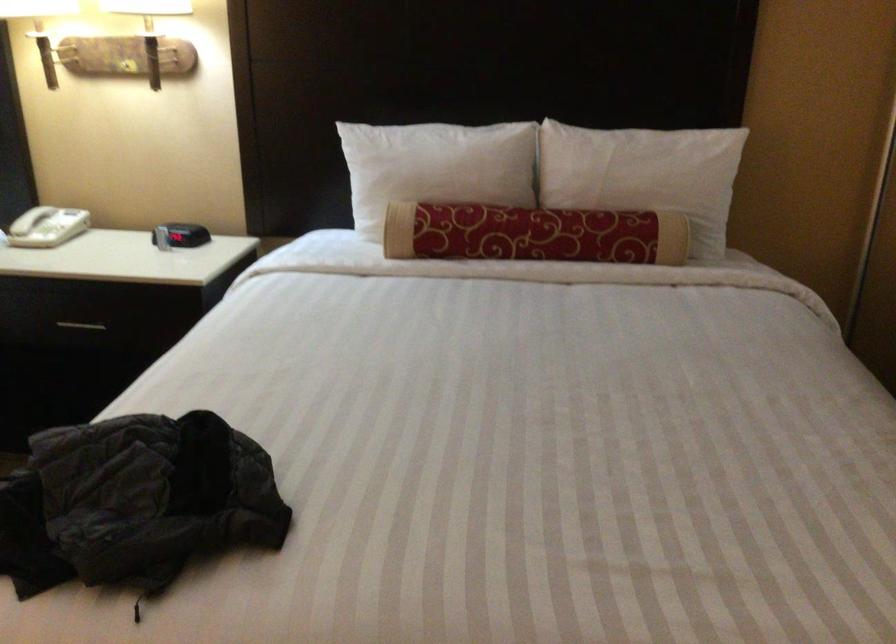
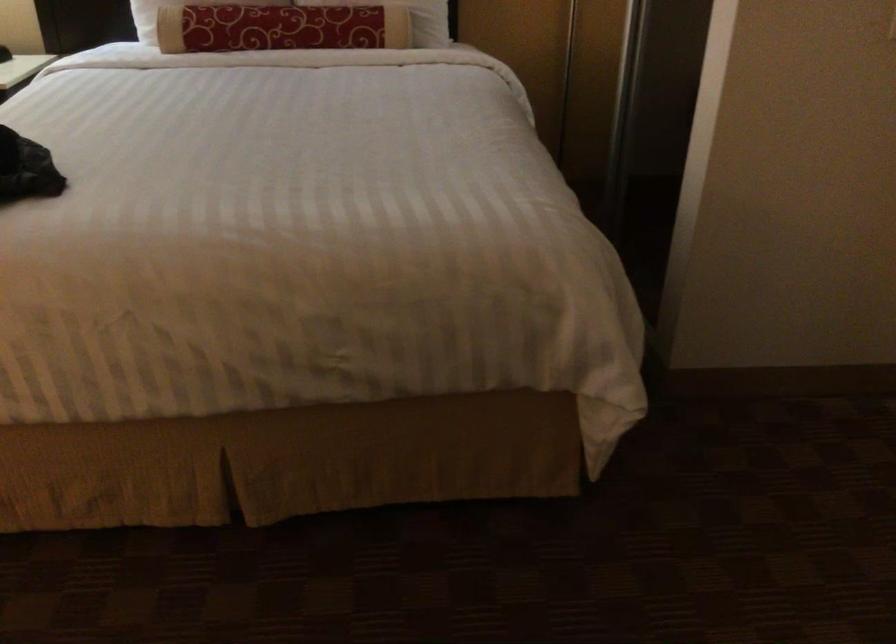
Question: Based on the continuous images, in which direction is the camera rotating? Reply with the corresponding letter.

Choices:
 (A) Left
 (B) Right
 (C) Up
 (D) Down

Answer: (D)